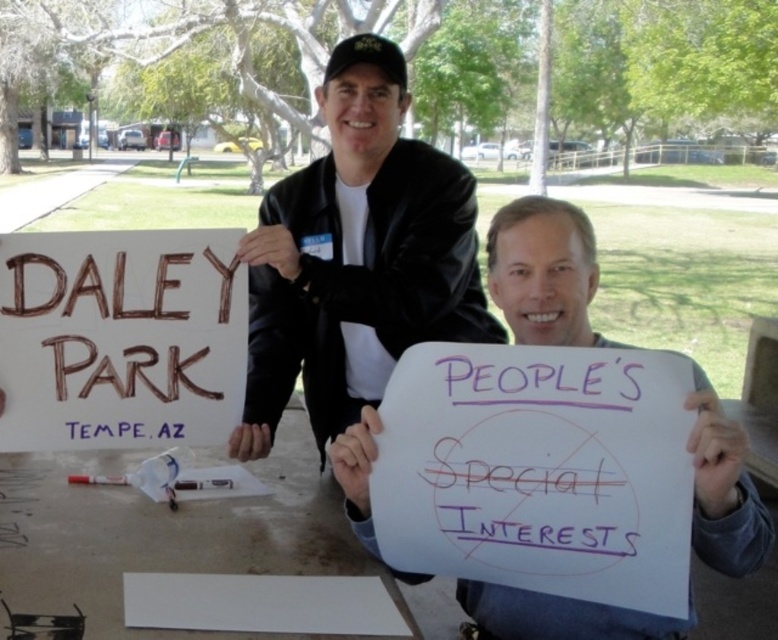
Question: Does black leather jacket at center appear on the left side of brown cardboard sign at upper left?

Choices:
 (A) no
 (B) yes

Answer: (A)

Question: Is black leather jacket at center positioned at the back of brown cardboard sign at upper left?

Choices:
 (A) yes
 (B) no

Answer: (A)

Question: Among these points, which one is farthest from the camera?

Choices:
 (A) (398, 186)
 (B) (144, 323)

Answer: (A)

Question: Can you confirm if black leather jacket at center is positioned to the left of brown cardboard sign at upper left?

Choices:
 (A) yes
 (B) no

Answer: (B)

Question: Which point is closer to the camera?

Choices:
 (A) (398, 355)
 (B) (4, 276)

Answer: (B)

Question: Which point is farther from the camera taking this photo?

Choices:
 (A) (212, 324)
 (B) (312, 260)

Answer: (B)